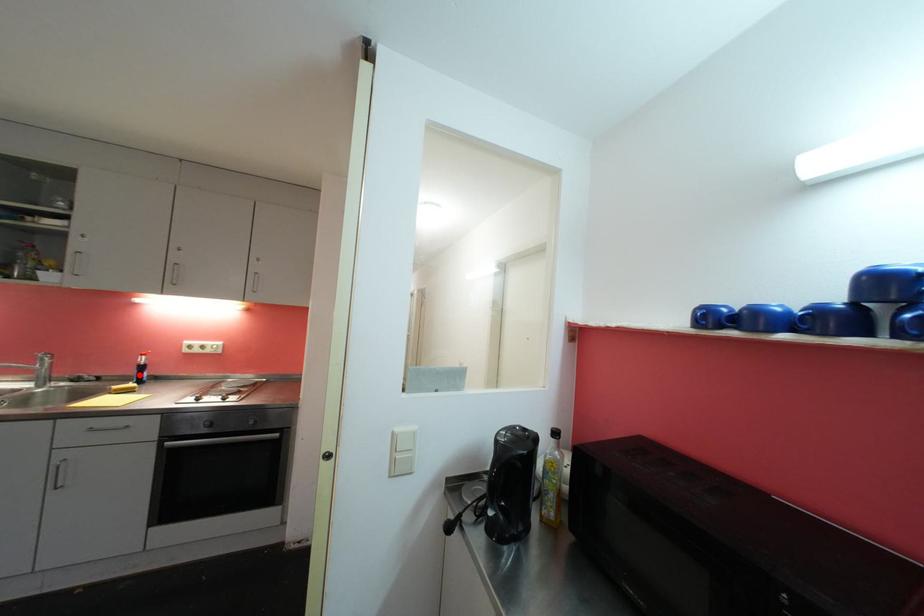
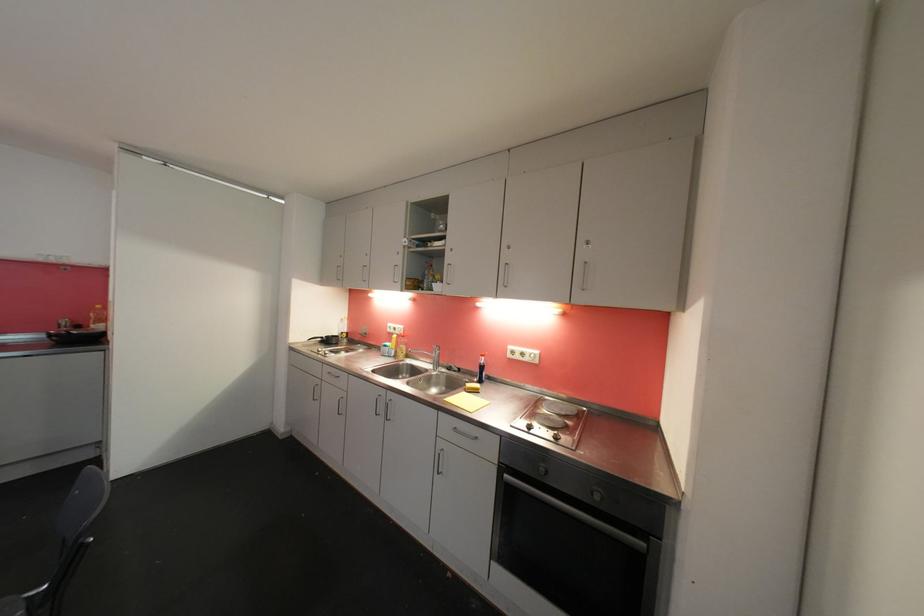
Question: A red point is marked in image1. In image2, is the corresponding 3D point closer to the camera or farther? Reply with the corresponding letter.

Choices:
 (A) The corresponding 3D point is closer.
 (B) The corresponding 3D point is farther.

Answer: (B)